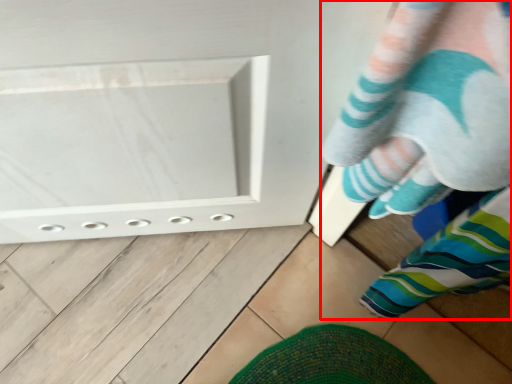
Question: In this image, where is person (annotated by the red box) located relative to footwear?

Choices:
 (A) left
 (B) right

Answer: (A)